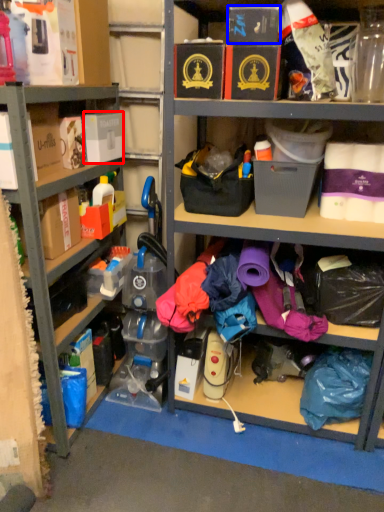
Question: Which of the following is the farthest to the observer, storage box (highlighted by a red box) or storage box (highlighted by a blue box)?

Choices:
 (A) storage box
 (B) storage box

Answer: (A)